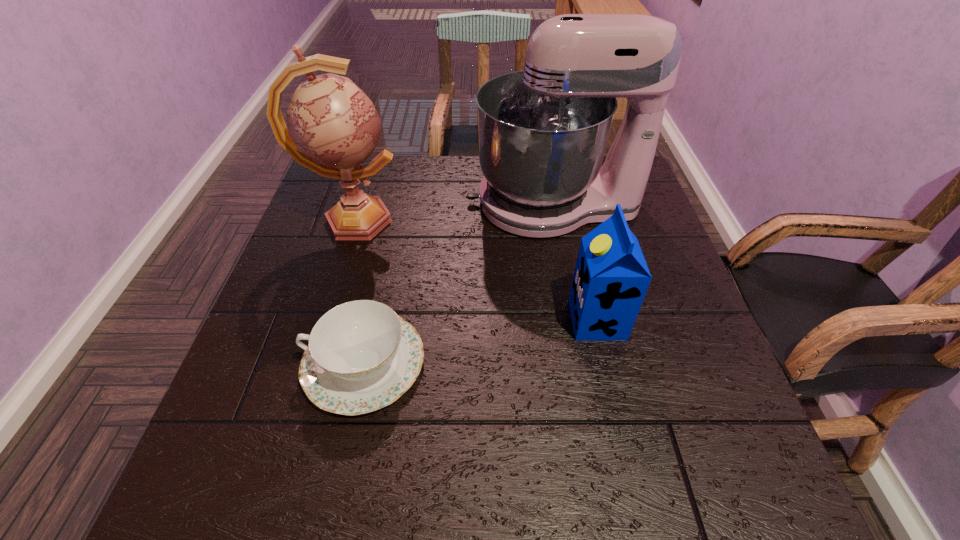
At what (x,y) coordinates should I click in order to perform the action: click on mixer. Please return your answer as a coordinate pair (x, y). The height and width of the screenshot is (540, 960). Looking at the image, I should click on (542, 132).

Identify the location of globe. (333, 127).

Locate an element on the screen. carton is located at coordinates (611, 278).

Locate an element on the screen. chinaware is located at coordinates (361, 356).

Image resolution: width=960 pixels, height=540 pixels. In order to click on free space located on the front-facing side of the mixer in this screenshot , I will do `click(430, 204)`.

This screenshot has height=540, width=960. I want to click on vacant space located on the front-facing side of the mixer, so coord(396,204).

Locate an element on the screen. Image resolution: width=960 pixels, height=540 pixels. vacant area situated 0.150m on the front-facing side of the mixer is located at coordinates (411, 204).

Where is `free location located 0.270m on the front-facing side of the globe`? free location located 0.270m on the front-facing side of the globe is located at coordinates (508, 220).

The image size is (960, 540). I want to click on free space located 0.220m with the cap open on the third tallest object, so click(465, 320).

Locate an element on the screen. free space located 0.070m with the cap open on the third tallest object is located at coordinates (537, 320).